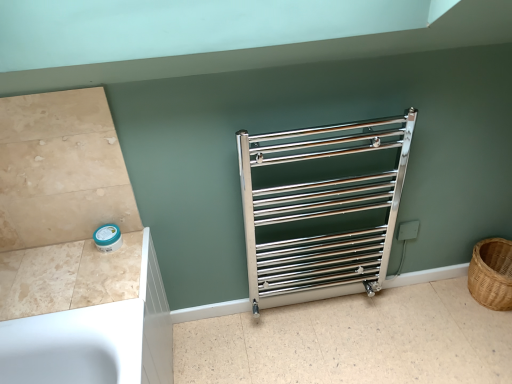
Locate an element on the screen. free spot to the left of polished chrome towel rack at center is located at coordinates (242, 344).